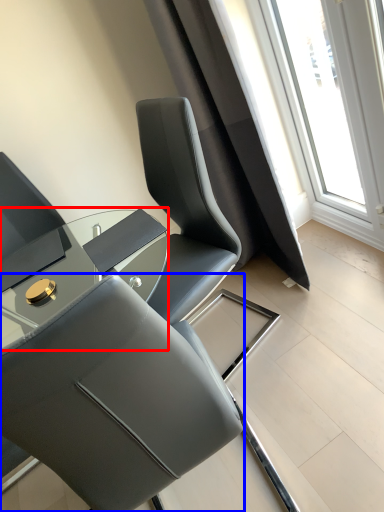
Question: Which object is further to the camera taking this photo, table (highlighted by a red box) or chair (highlighted by a blue box)?

Choices:
 (A) table
 (B) chair

Answer: (A)